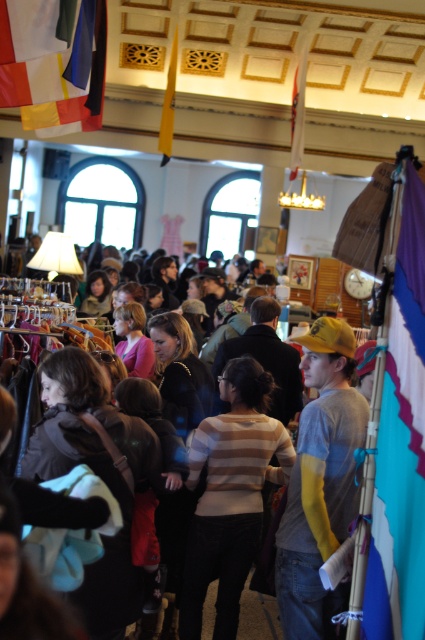
Is striped sweater at center wider than white fabric flag at upper center?

Yes, striped sweater at center is wider than white fabric flag at upper center.

Can you confirm if striped sweater at center is positioned above white fabric flag at upper center?

Incorrect, striped sweater at center is not positioned above white fabric flag at upper center.

You are a GUI agent. You are given a task and a screenshot of the screen. Output one action in this format:
    pyautogui.click(x=<x>, y=<y>)
    Task: Click on the striped sweater at center
    The image size is (425, 640).
    Given the screenshot: What is the action you would take?
    pyautogui.click(x=229, y=493)

The height and width of the screenshot is (640, 425). I want to click on striped sweater at center, so click(229, 493).

I want to click on striped sweater at center, so click(x=229, y=493).

In the scene shown: Is striped sweater at center positioned in front of white fabric flag at upper left?

Yes.

Where is `striped sweater at center`? This screenshot has width=425, height=640. striped sweater at center is located at coordinates (229, 493).

Between point (382, 499) and point (362, 413), which one is positioned behind?

The point (362, 413) is behind.

Does point (385, 540) come in front of point (302, 490)?

Yes.

Locate an element on the screen. This screenshot has height=640, width=425. blue fabric flag at right is located at coordinates (401, 442).